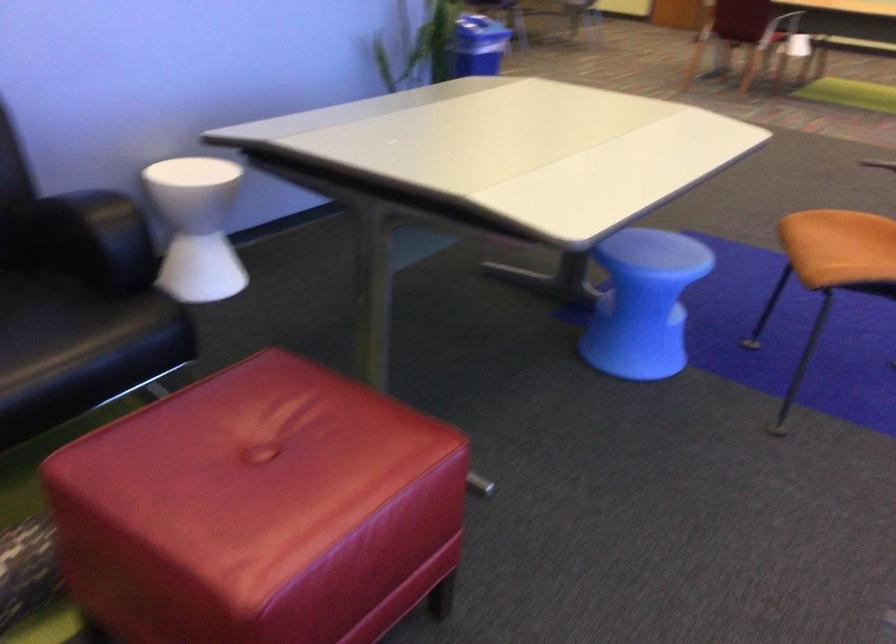
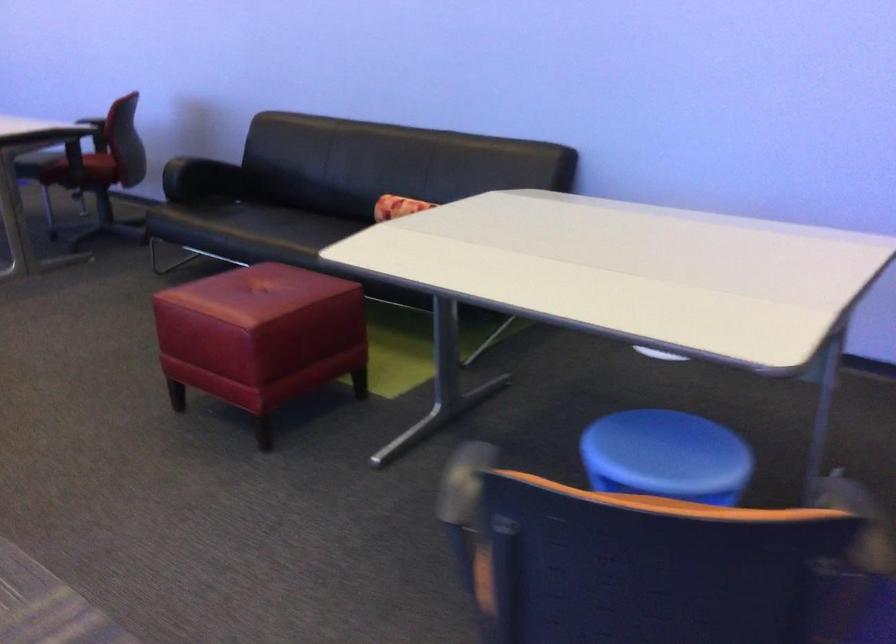
Find the pixel in the second image that matches (x=260, y=453) in the first image.

(260, 292)